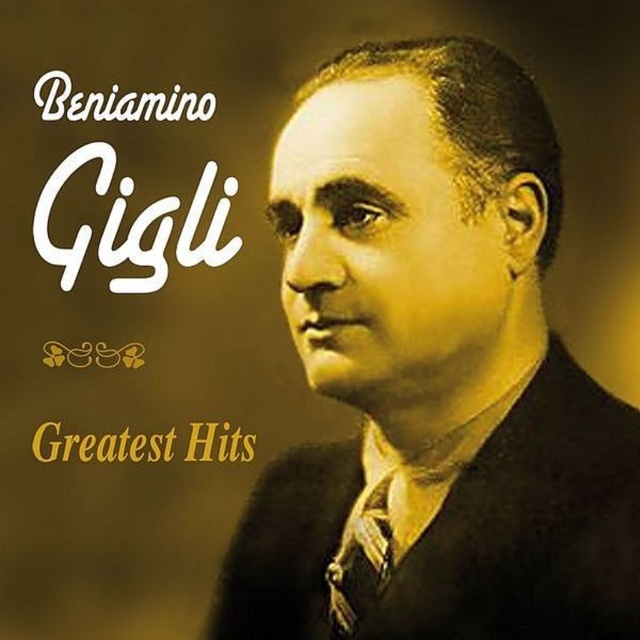
You are designing a layout for a music album cover. You have the white paper text at upper left and the matte black tie at center. According to the image, which object is placed higher on the page?

The white paper text at upper left is placed higher on the page than the matte black tie at center.